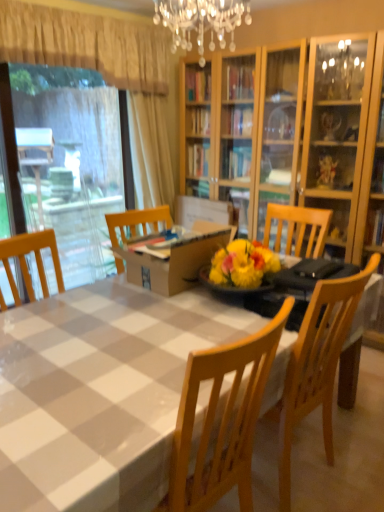
Image resolution: width=384 pixels, height=512 pixels. Describe the element at coordinates (174, 263) in the screenshot. I see `brown cardboard box at center` at that location.

Where is `brown cardboard box at center`? Image resolution: width=384 pixels, height=512 pixels. brown cardboard box at center is located at coordinates (174, 263).

What do you see at coordinates (70, 164) in the screenshot?
I see `transparent plastic window screen at left` at bounding box center [70, 164].

Identify the location of white checkered tablecloth at center. (99, 392).

Looking at their sizes, would you say wooden chair at center is wider or thinner than transparent plastic window screen at left?

Considering their sizes, wooden chair at center looks broader than transparent plastic window screen at left.

How distant is wooden chair at center from transparent plastic window screen at left?

wooden chair at center is 12.28 feet away from transparent plastic window screen at left.

Is wooden chair at center not close to transparent plastic window screen at left?

wooden chair at center is positioned a significant distance from transparent plastic window screen at left.

From a real-world perspective, is wooden chair at center on top of transparent plastic window screen at left?

Actually, wooden chair at center is physically below transparent plastic window screen at left in the real world.

Is beige fabric curtain at upper left to the left or to the right of brown cardboard box at center in the image?

In the image, beige fabric curtain at upper left appears on the left side of brown cardboard box at center.

Is beige fabric curtain at upper left turned away from brown cardboard box at center?

No, beige fabric curtain at upper left is not facing the opposite direction of brown cardboard box at center.

From the image's perspective, is beige fabric curtain at upper left above or below brown cardboard box at center?

Clearly, from the image's perspective, beige fabric curtain at upper left is above brown cardboard box at center.

How much distance is there between brown cardboard box at center and wooden chair at center?

28.13 inches.

From the picture: What's the angular difference between brown cardboard box at center and wooden chair at center's facing directions?

The facing directions of brown cardboard box at center and wooden chair at center are 89.9 degrees apart.

From a real-world perspective, between brown cardboard box at center and wooden chair at center, who is vertically lower?

wooden chair at center, from a real-world perspective.

Is brown cardboard box at center with wooden chair at center?

No, brown cardboard box at center is not with wooden chair at center.

Looking at the image, does beige fabric curtain at upper left seem bigger or smaller compared to white checkered tablecloth at center?

In the image, beige fabric curtain at upper left appears to be smaller than white checkered tablecloth at center.

Which is more to the right, beige fabric curtain at upper left or white checkered tablecloth at center?

Positioned to the right is white checkered tablecloth at center.

Is beige fabric curtain at upper left not inside white checkered tablecloth at center?

Yes.

Is beige fabric curtain at upper left in front of or behind white checkered tablecloth at center in the image?

Clearly, beige fabric curtain at upper left is behind white checkered tablecloth at center.

Locate an element on the screen. The width and height of the screenshot is (384, 512). curtain on the left of wooden chair at center is located at coordinates (150, 151).

Which is closer, [150,131] or [286,374]?

Point [150,131].

Considering the sizes of beige fabric curtain at upper left and wooden chair at center in the image, is beige fabric curtain at upper left taller or shorter than wooden chair at center?

Considering their sizes, beige fabric curtain at upper left has more height than wooden chair at center.

Looking at this image, from the image's perspective, which one is positioned higher, beige fabric curtain at upper left or wooden chair at center?

beige fabric curtain at upper left.

Can you confirm if wooden chair at center is thinner than brown cardboard box at center?

Yes.

This screenshot has width=384, height=512. In the image, there is a wooden chair at center. Find the location of `cardboard box above it (from the image's perspective)`. cardboard box above it (from the image's perspective) is located at coordinates (174, 263).

Does wooden chair at center touch brown cardboard box at center?

No, wooden chair at center is not beside brown cardboard box at center.

In terms of height, does wooden chair at center look taller or shorter compared to brown cardboard box at center?

Considering their sizes, wooden chair at center has more height than brown cardboard box at center.

Considering the relative sizes of brown cardboard box at center and transparent plastic window screen at left in the image provided, is brown cardboard box at center wider than transparent plastic window screen at left?

Yes, brown cardboard box at center is wider than transparent plastic window screen at left.

Is brown cardboard box at center situated inside transparent plastic window screen at left or outside?

brown cardboard box at center is spatially situated outside transparent plastic window screen at left.

The image size is (384, 512). I want to click on cardboard box beneath the transparent plastic window screen at left (from a real-world perspective), so click(174, 263).

Considering the sizes of objects brown cardboard box at center and transparent plastic window screen at left in the image provided, who is bigger, brown cardboard box at center or transparent plastic window screen at left?

transparent plastic window screen at left is bigger.

You are a GUI agent. You are given a task and a screenshot of the screen. Output one action in this format:
    pyautogui.click(x=<x>, y=<y>)
    Task: Click on the window screen above the wooden chair at center (from the image's perspective)
    The height and width of the screenshot is (512, 384).
    Given the screenshot: What is the action you would take?
    pyautogui.click(x=70, y=164)

What are the coordinates of `cardboard box below the beige fabric curtain at upper left (from the image's perspective)` in the screenshot? It's located at (174, 263).

Estimate the real-world distances between objects in this image. Which object is further from brown cardboard box at center, transparent plastic window screen at left or white checkered tablecloth at center?

transparent plastic window screen at left lies further to brown cardboard box at center than the other object.

Looking at the image, which one is located closer to wooden chair at center, transparent plastic window screen at left or white checkered tablecloth at center?

white checkered tablecloth at center is closer to wooden chair at center.

Which object lies nearer to the anchor point transparent plastic window screen at left, white checkered tablecloth at center or beige fabric curtain at upper left?

beige fabric curtain at upper left is positioned closer to the anchor transparent plastic window screen at left.

Which object lies nearer to the anchor point beige fabric curtain at upper left, brown cardboard box at center or wooden chair at center?

brown cardboard box at center is positioned closer to the anchor beige fabric curtain at upper left.

Consider the image. Looking at the image, which one is located further to white checkered tablecloth at center, beige fabric curtain at upper left or transparent plastic window screen at left?

Based on the image, transparent plastic window screen at left appears to be further to white checkered tablecloth at center.

Estimate the real-world distances between objects in this image. Which object is closer to wooden chair at center, white checkered tablecloth at center or brown cardboard box at center?

white checkered tablecloth at center.

Looking at the image, which one is located further to wooden chair at center, brown cardboard box at center or transparent plastic window screen at left?

Among the two, transparent plastic window screen at left is located further to wooden chair at center.

Based on their spatial positions, is wooden chair at center or white checkered tablecloth at center further from brown cardboard box at center?

wooden chair at center is further to brown cardboard box at center.

Find the location of `cardboard box between wooden chair at center and transparent plastic window screen at left along the z-axis`. cardboard box between wooden chair at center and transparent plastic window screen at left along the z-axis is located at coordinates (174, 263).

Locate an element on the screen. Image resolution: width=384 pixels, height=512 pixels. cardboard box between white checkered tablecloth at center and beige fabric curtain at upper left in the front-back direction is located at coordinates (174, 263).

Where is `window screen between white checkered tablecloth at center and beige fabric curtain at upper left in the front-back direction`? The width and height of the screenshot is (384, 512). window screen between white checkered tablecloth at center and beige fabric curtain at upper left in the front-back direction is located at coordinates (70, 164).

Where is `chair between white checkered tablecloth at center and transparent plastic window screen at left in the front-back direction`? Image resolution: width=384 pixels, height=512 pixels. chair between white checkered tablecloth at center and transparent plastic window screen at left in the front-back direction is located at coordinates (317, 364).